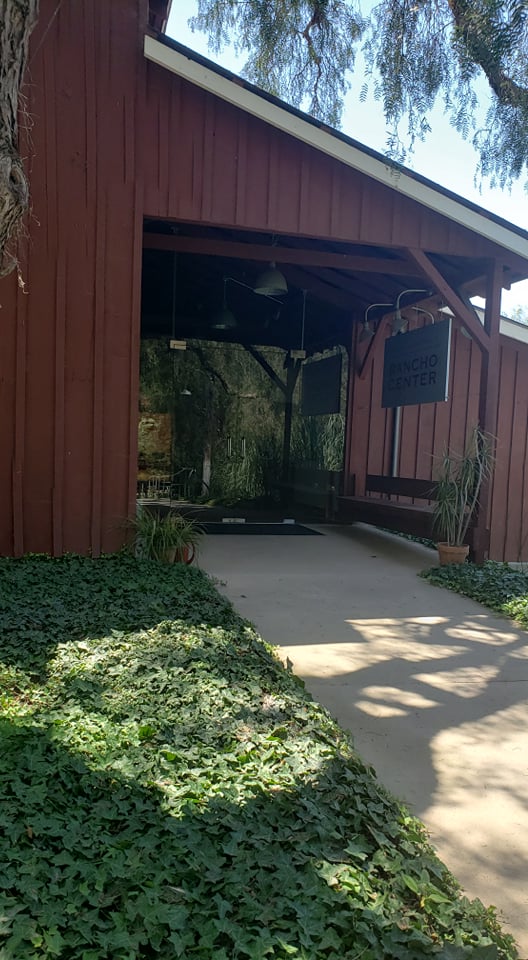
The height and width of the screenshot is (960, 528). What are the coordinates of `plant pots` in the screenshot? It's located at (447, 549), (168, 553), (178, 557).